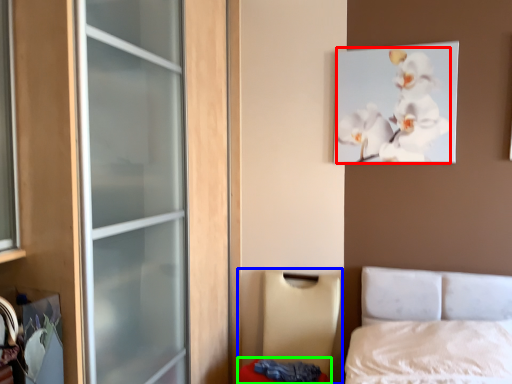
Question: Based on their relative distances, which object is nearer to flower (highlighted by a red box)? Choose from furniture (highlighted by a blue box) and mattress (highlighted by a green box).

Choices:
 (A) furniture
 (B) mattress

Answer: (A)